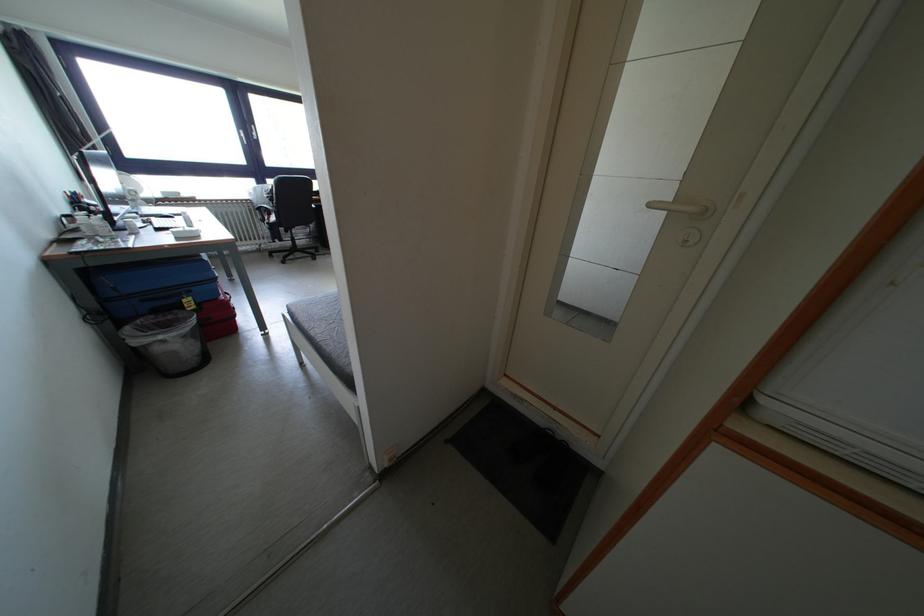
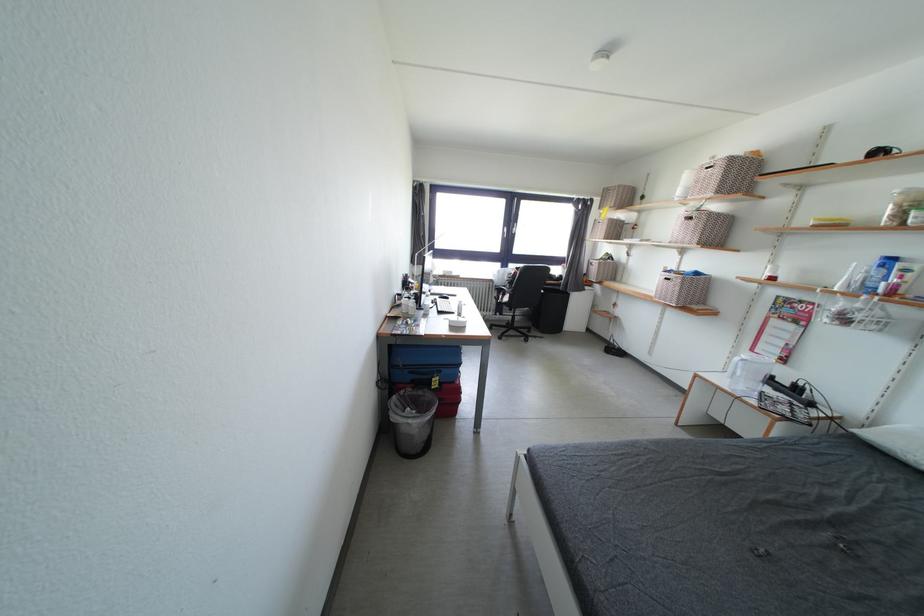
The point at (167, 342) is marked in the first image. Where is the corresponding point in the second image?

(417, 426)